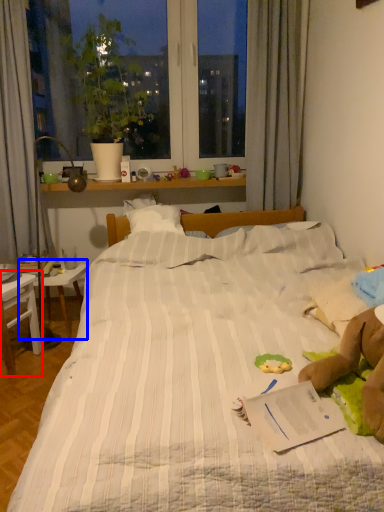
Question: Which of the following is the farthest to the observer, table (highlighted by a red box) or table (highlighted by a blue box)?

Choices:
 (A) table
 (B) table

Answer: (B)